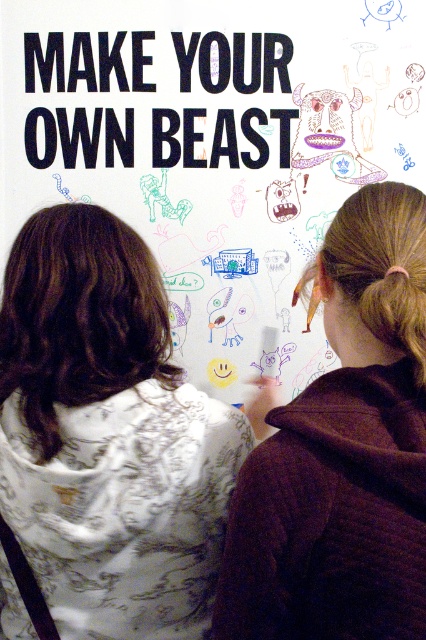
Can you confirm if white printed hoodie at left is positioned to the left of brown quilted hoodie at upper right?

Correct, you'll find white printed hoodie at left to the left of brown quilted hoodie at upper right.

Is white printed hoodie at left taller than brown quilted hoodie at upper right?

Correct, white printed hoodie at left is much taller as brown quilted hoodie at upper right.

Between point (58, 545) and point (412, 550), which one is positioned in front?

Positioned in front is point (412, 550).

At what (x,y) coordinates should I click in order to perform the action: click on white printed hoodie at left. Please return your answer as a coordinate pair (x, y). Image resolution: width=426 pixels, height=640 pixels. Looking at the image, I should click on (108, 435).

Between brown quilted hoodie at upper right and dark brown hair at upper left, which one has less height?

Standing shorter between the two is dark brown hair at upper left.

Is brown quilted hoodie at upper right shorter than dark brown hair at upper left?

In fact, brown quilted hoodie at upper right may be taller than dark brown hair at upper left.

Where is `brown quilted hoodie at upper right`? This screenshot has width=426, height=640. brown quilted hoodie at upper right is located at coordinates (342, 451).

Which of these two, dark brown hair at upper left or blackmaterial/texture at upper center, stands shorter?

Standing shorter between the two is blackmaterial/texture at upper center.

Is dark brown hair at upper left taller than blackmaterial/texture at upper center?

Yes.

The height and width of the screenshot is (640, 426). I want to click on dark brown hair at upper left, so [78, 316].